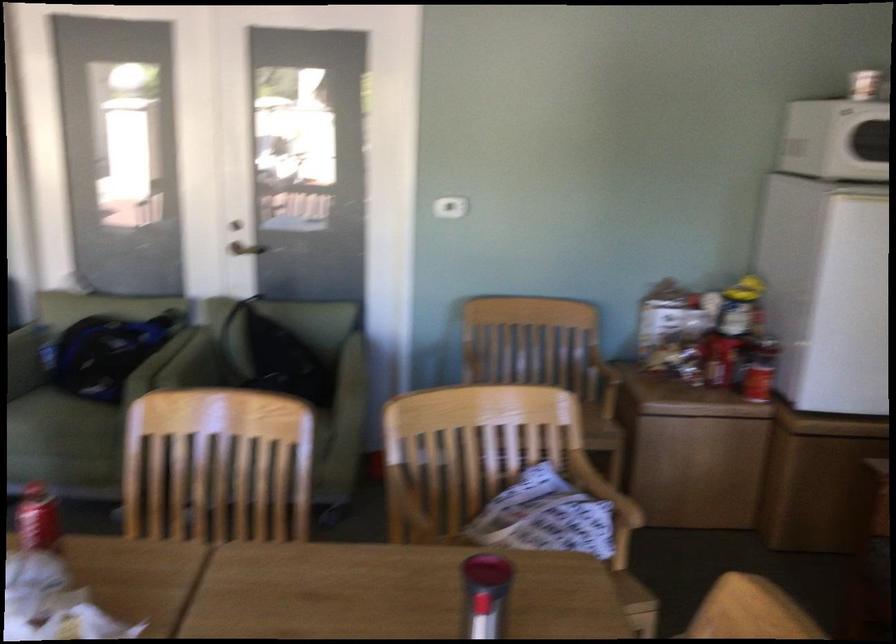
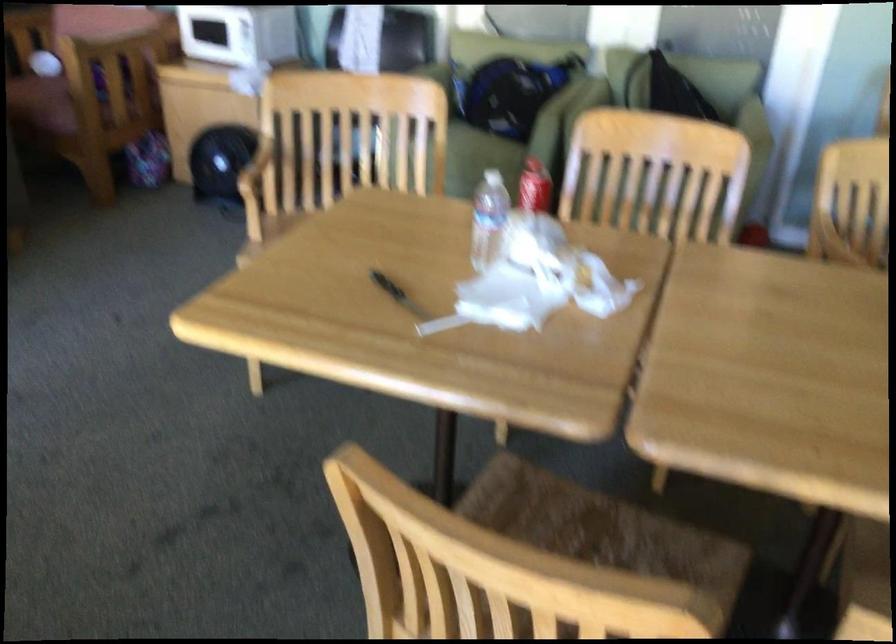
Find the pixel in the second image that matches the point at 74,439 in the first image.

(479, 160)